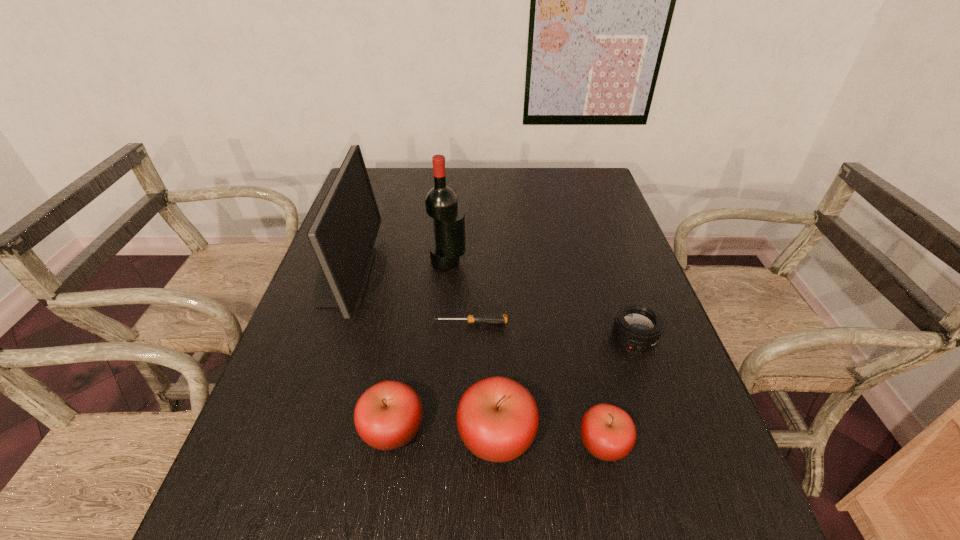
This screenshot has width=960, height=540. In order to click on screwdriver in this screenshot , I will do `click(492, 318)`.

You are a GUI agent. You are given a task and a screenshot of the screen. Output one action in this format:
    pyautogui.click(x=<x>, y=<y>)
    Task: Click on the vacant space situated on the back of the fourth tallest object
    
    Given the screenshot: What is the action you would take?
    pyautogui.click(x=403, y=363)

You are a GUI agent. You are given a task and a screenshot of the screen. Output one action in this format:
    pyautogui.click(x=<x>, y=<y>)
    Task: Click on the vacant space located 0.050m on the right of the second apple from right to left
    This screenshot has width=960, height=540.
    Given the screenshot: What is the action you would take?
    pyautogui.click(x=562, y=437)

What are the coordinates of `free space located 0.070m on the back of the shortest apple` in the screenshot? It's located at (591, 390).

Identify the location of free space located 0.150m on the back of the wine bottle. The image size is (960, 540). [x=451, y=224].

I want to click on vacant point located on the screen side of the computer monitor, so coord(517,275).

Image resolution: width=960 pixels, height=540 pixels. I want to click on vacant space located on the side of the second shortest object with brand markings and control switches, so click(x=650, y=387).

The width and height of the screenshot is (960, 540). What are the coordinates of `vacant space located 0.350m on the front of the shortest object` in the screenshot? It's located at (x=468, y=471).

At what (x,y) coordinates should I click in order to perform the action: click on object present at the left edge. Please return your answer as a coordinate pair (x, y). The image size is (960, 540). Looking at the image, I should click on (342, 235).

Where is `apple that is positioned at the right edge`? apple that is positioned at the right edge is located at coordinates (608, 432).